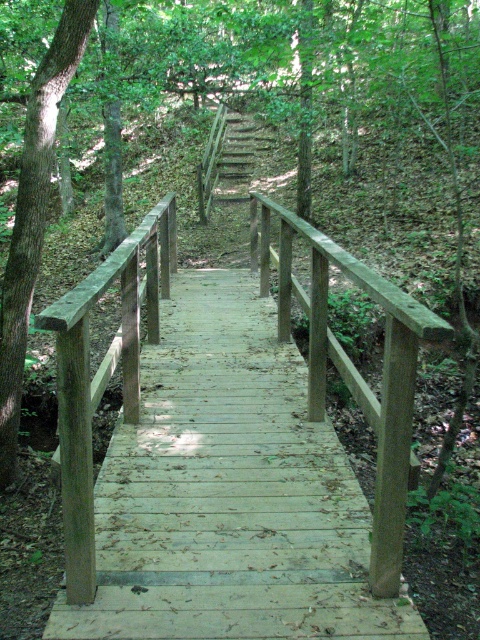
Question: Observing the image, what is the correct spatial positioning of light brown wooden rail at center in reference to smooth brown tree trunk at left?

Choices:
 (A) left
 (B) right

Answer: (B)

Question: Where is light brown wooden rail at center located in relation to wooden stairs at center in the image?

Choices:
 (A) right
 (B) left

Answer: (A)

Question: Which of the following is the closest to the observer?

Choices:
 (A) light brown wooden rail at center
 (B) smooth brown tree trunk at left
 (C) wooden stairs at center

Answer: (A)

Question: Can you confirm if smooth brown tree trunk at left is wider than wooden stairs at center?

Choices:
 (A) yes
 (B) no

Answer: (A)

Question: Based on their relative distances, which object is farther from the wooden stairs at center?

Choices:
 (A) smooth brown tree trunk at left
 (B) light brown wooden rail at center

Answer: (B)

Question: Which of these objects is positioned closest to the smooth brown tree trunk at left?

Choices:
 (A) wooden stairs at center
 (B) light brown wooden rail at center

Answer: (B)